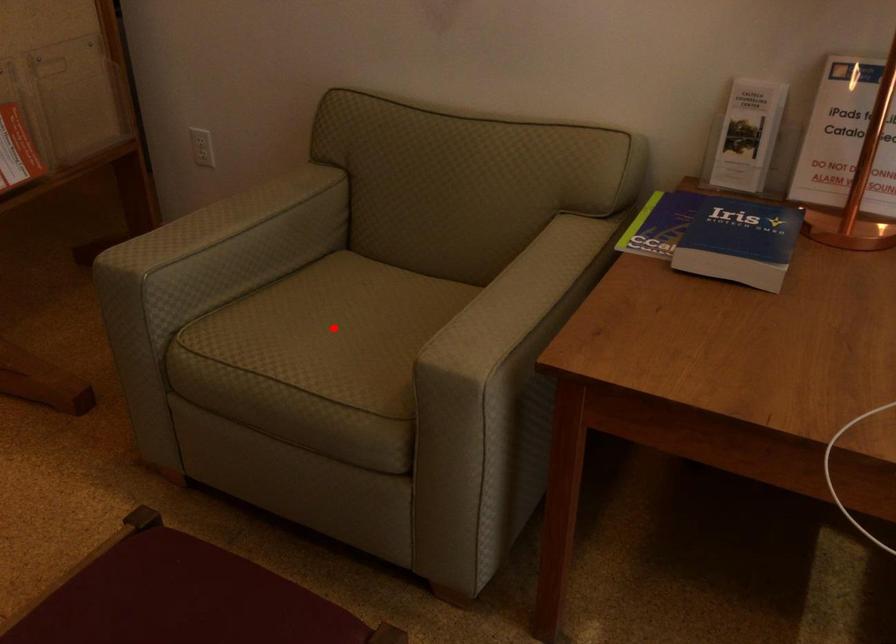
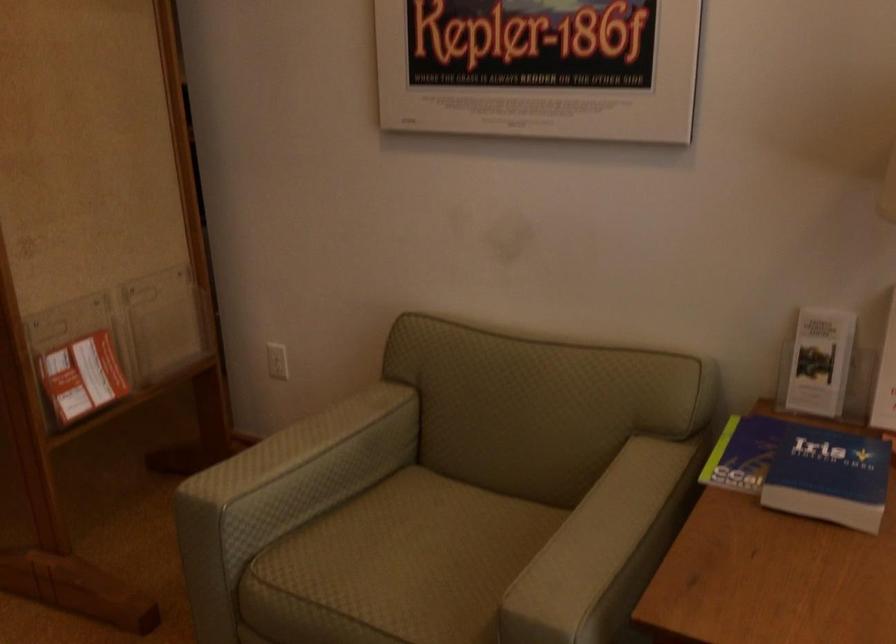
In the second image, find the point that corresponds to the highlighted location in the first image.

(407, 563)